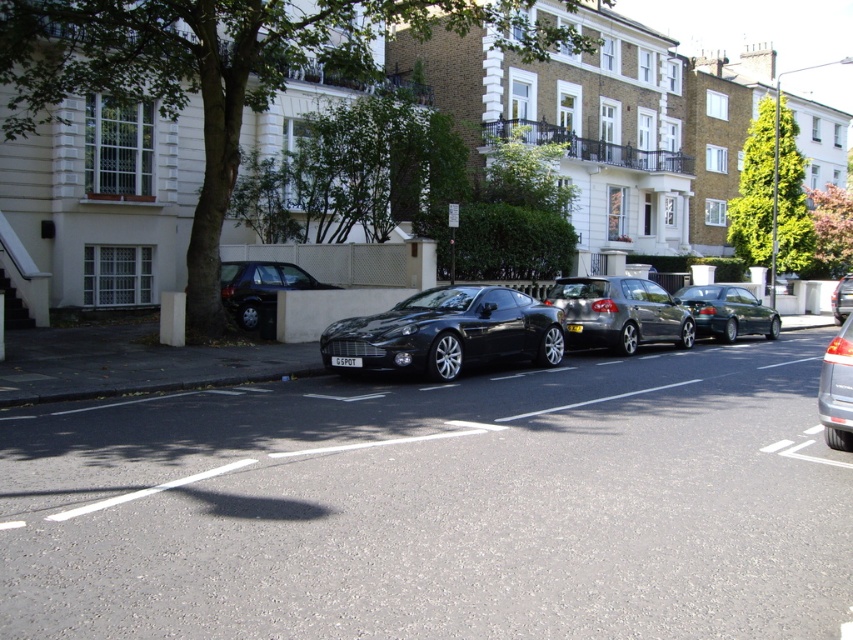
Does satin silver sedan at center appear under black metallic license plate at center?

Actually, satin silver sedan at center is above black metallic license plate at center.

Does point (573, 284) come behind point (573, 328)?

That is True.

This screenshot has height=640, width=853. What are the coordinates of `satin silver sedan at center` in the screenshot? It's located at tap(619, 312).

Which is behind, point (612, 342) or point (337, 365)?

The point (612, 342) is more distant.

Find the location of a particular element. The height and width of the screenshot is (640, 853). satin silver sedan at center is located at coordinates (619, 312).

Find the location of a particular element. Image resolution: width=853 pixels, height=640 pixels. satin silver sedan at center is located at coordinates (619, 312).

Does black glossy car at center have a larger size compared to satin silver sedan at center?

Yes, black glossy car at center is bigger than satin silver sedan at center.

Image resolution: width=853 pixels, height=640 pixels. In order to click on black glossy car at center in this screenshot , I will do `click(448, 332)`.

Which is behind, point (357, 330) or point (636, 282)?

Point (636, 282)

Where is `black glossy car at center`? This screenshot has width=853, height=640. black glossy car at center is located at coordinates (448, 332).